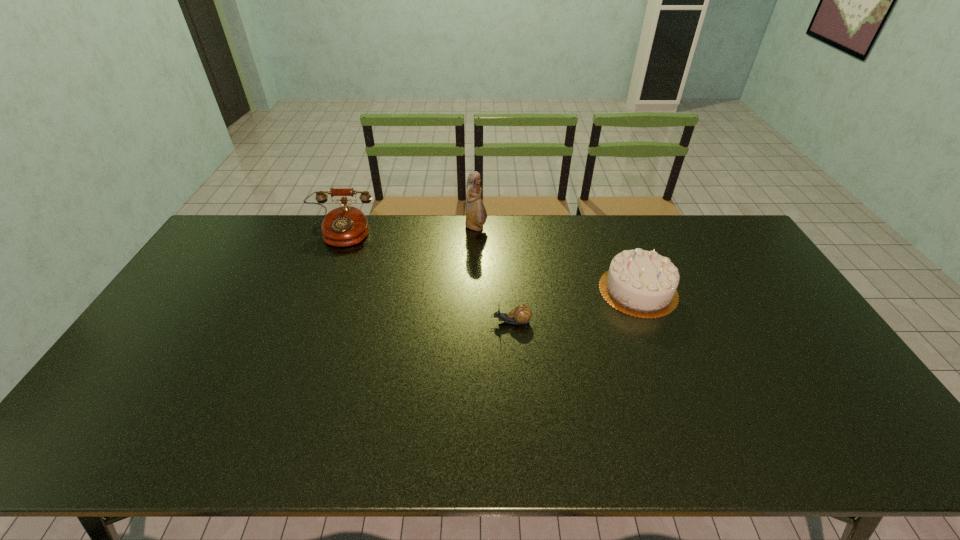
At what (x,y) coordinates should I click in order to perform the action: click on figurine. Please return your answer as a coordinate pair (x, y). Looking at the image, I should click on (476, 215).

You are a GUI agent. You are given a task and a screenshot of the screen. Output one action in this format:
    pyautogui.click(x=<x>, y=<y>)
    Task: Click on the second object from left to right
    The image size is (960, 540).
    Given the screenshot: What is the action you would take?
    pyautogui.click(x=476, y=215)

Locate an element on the screen. The height and width of the screenshot is (540, 960). telephone is located at coordinates (344, 226).

Where is `the rightmost object`? The height and width of the screenshot is (540, 960). the rightmost object is located at coordinates (640, 283).

I want to click on escargot, so click(x=522, y=313).

The height and width of the screenshot is (540, 960). I want to click on the second object from right to left, so click(x=522, y=313).

What are the coordinates of `vacant space situated 0.100m on the front-facing side of the figurine` in the screenshot? It's located at tap(515, 228).

This screenshot has width=960, height=540. Identify the location of vacant space located on the dial of the telephone. (328, 265).

Find the location of a particular element. The image size is (960, 540). vacant space located 0.220m on the back of the birthday cake is located at coordinates (613, 227).

Image resolution: width=960 pixels, height=540 pixels. Identify the location of free point located on the front-facing side of the escargot. (354, 322).